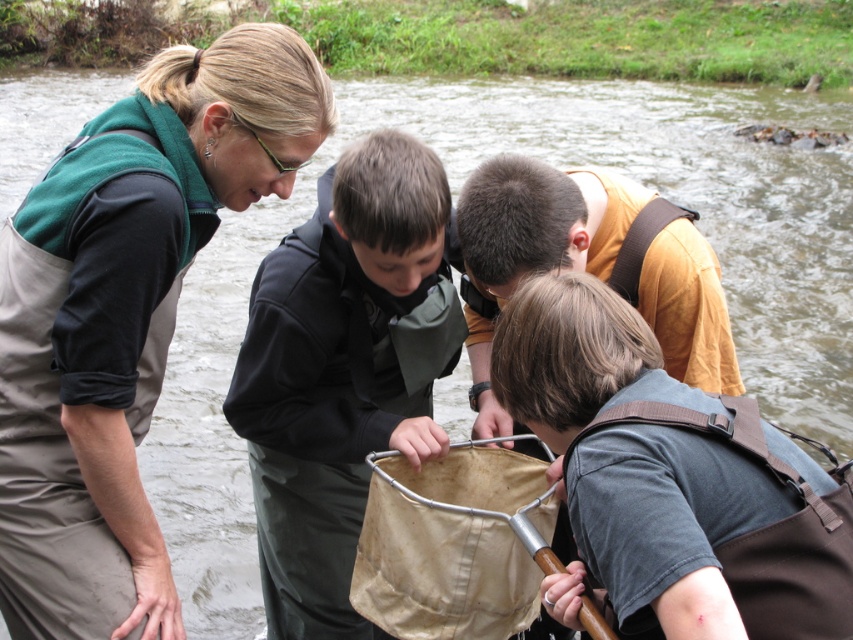
Is point (373, 253) less distant than point (521, 163)?

No, (373, 253) is behind (521, 163).

Does dark gray fabric jacket at center appear on the left side of orange cotton shirt at center?

Yes, dark gray fabric jacket at center is to the left of orange cotton shirt at center.

Is point (286, 344) in front of point (480, 230)?

No.

Where is `dark gray fabric jacket at center`? This screenshot has width=853, height=640. dark gray fabric jacket at center is located at coordinates (343, 371).

Is matte gray waders at left taller than brown fabric backpack at lower right?

Indeed, matte gray waders at left has a greater height compared to brown fabric backpack at lower right.

Find the location of `matte gray waders at left`. matte gray waders at left is located at coordinates (125, 316).

Does matte gray waders at left have a lesser height compared to dark gray fabric jacket at center?

Correct, matte gray waders at left is not as tall as dark gray fabric jacket at center.

Can you confirm if matte gray waders at left is smaller than dark gray fabric jacket at center?

Correct, matte gray waders at left occupies less space than dark gray fabric jacket at center.

Who is more forward, (119, 292) or (325, 314)?

Positioned in front is point (119, 292).

Image resolution: width=853 pixels, height=640 pixels. In order to click on matte gray waders at left in this screenshot , I will do `click(125, 316)`.